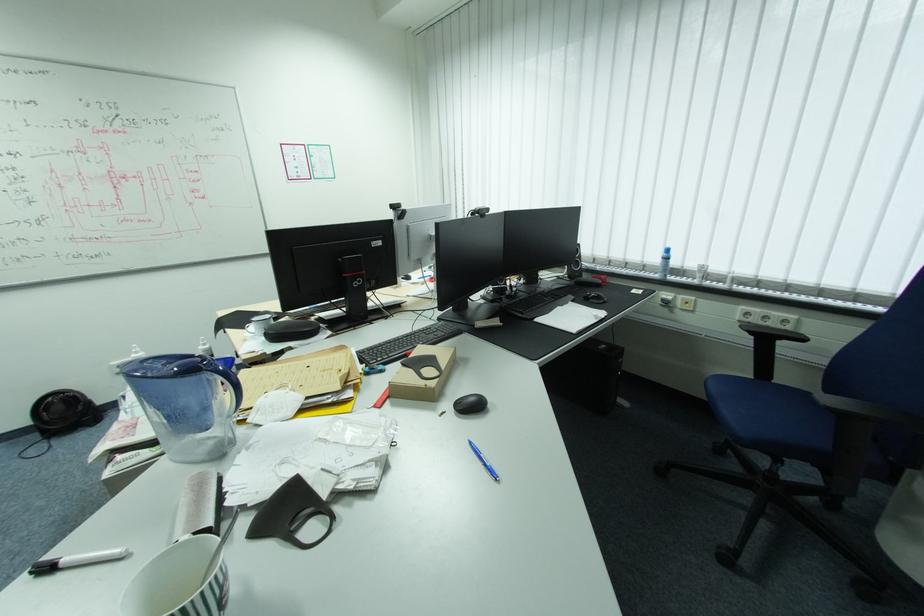
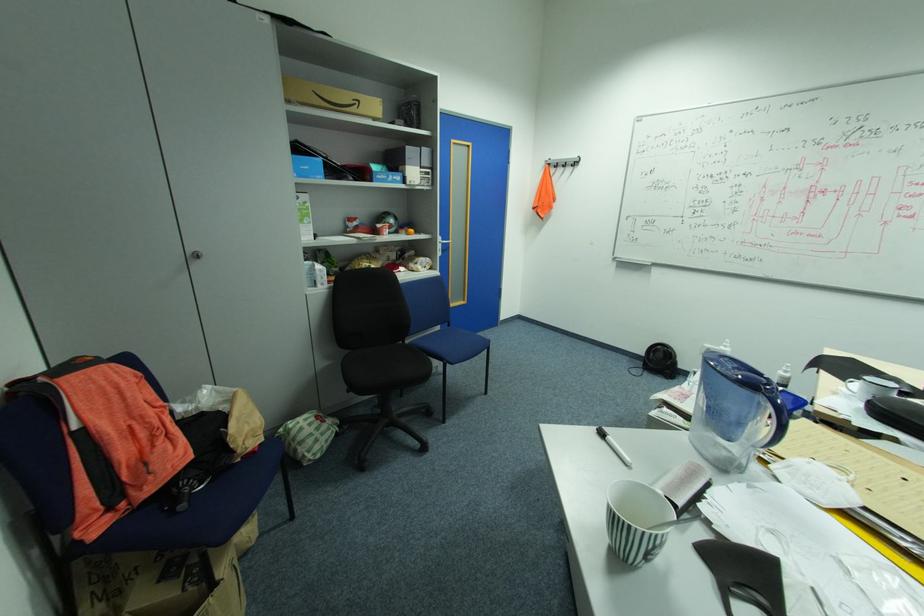
Based on the continuous images, in which direction is the camera rotating?

The rotation direction of the camera is left-down.